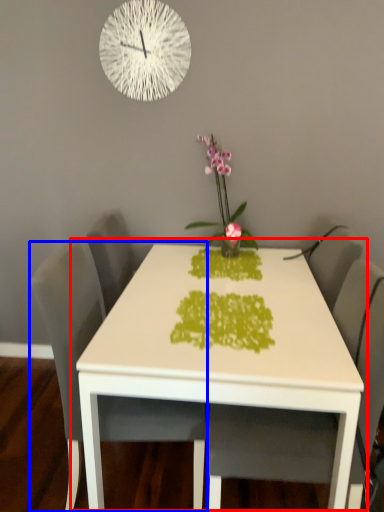
Question: Which object appears farthest to the camera in this image, table (highlighted by a red box) or chair (highlighted by a blue box)?

Choices:
 (A) table
 (B) chair

Answer: (B)